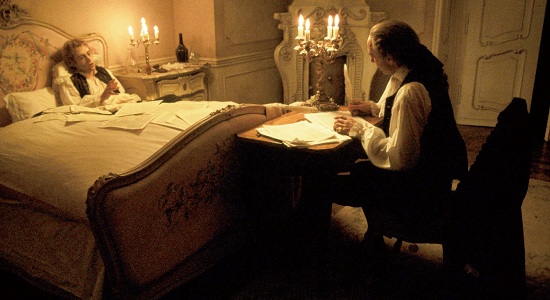
The height and width of the screenshot is (300, 550). In order to click on pillows in this screenshot , I will do `click(27, 98)`, `click(57, 71)`.